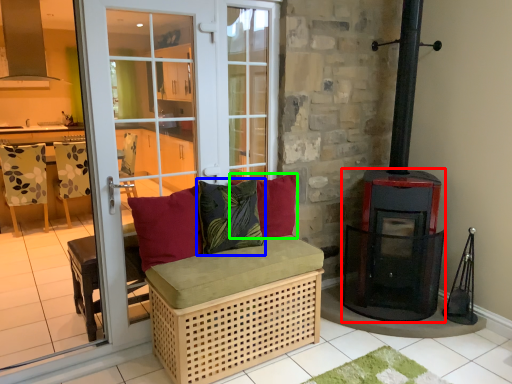
Question: Considering the real-world distances, which object is farthest from wood burning stove (highlighted by a red box)? pillow (highlighted by a blue box) or pillow (highlighted by a green box)?

Choices:
 (A) pillow
 (B) pillow

Answer: (A)